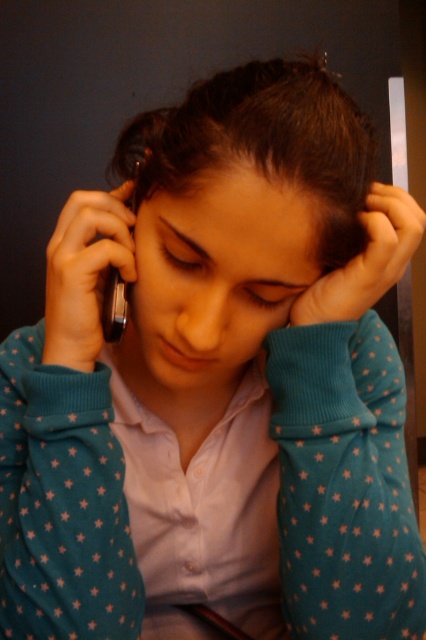
Question: Can you confirm if matte black phone at center is positioned to the left of black matte phone at left?

Choices:
 (A) yes
 (B) no

Answer: (B)

Question: Where is black matte phone at left located in relation to blue fabric hand at center in the image?

Choices:
 (A) below
 (B) above

Answer: (B)

Question: Which of the following is the closest to the observer?

Choices:
 (A) (129, 202)
 (B) (331, 154)

Answer: (B)

Question: Which of the following is the farthest from the observer?

Choices:
 (A) (340, 134)
 (B) (129, 266)
 (C) (118, 188)

Answer: (C)

Question: Which of the following is the closest to the observer?

Choices:
 (A) matte black phone at center
 (B) black glossy smartphone at left
 (C) blue fabric hand at center
 (D) black matte phone at left

Answer: (A)

Question: In this image, where is matte black phone at center located relative to black glossy smartphone at left?

Choices:
 (A) above
 (B) below

Answer: (A)